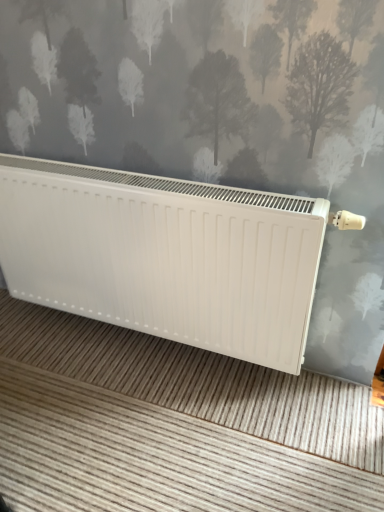
Find the location of a particular element. white plastic radiator at center is located at coordinates (164, 256).

What is the approximate width of white plastic radiator at center?

The width of white plastic radiator at center is 4.43 inches.

What do you see at coordinates (164, 256) in the screenshot?
I see `white plastic radiator at center` at bounding box center [164, 256].

I want to click on white plastic radiator at center, so click(164, 256).